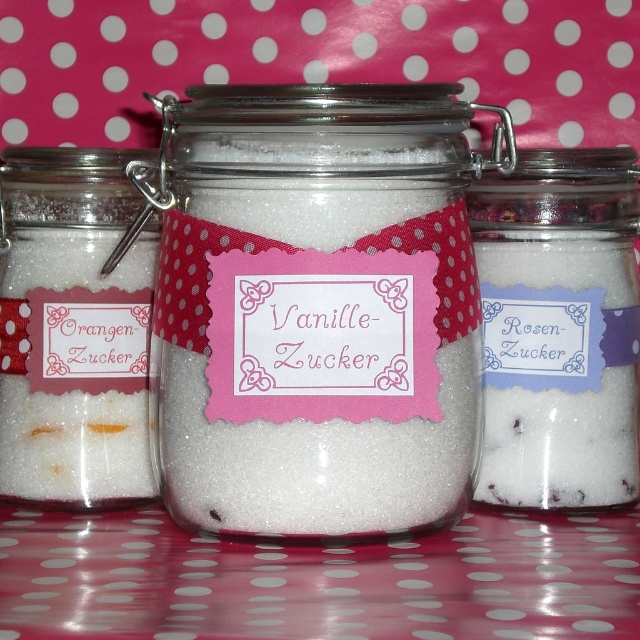
Question: Can you confirm if white sugar at center is positioned to the right of matte white sugar at left?

Choices:
 (A) no
 (B) yes

Answer: (B)

Question: Is pink polka dot fabric at center below white sugar at center?

Choices:
 (A) yes
 (B) no

Answer: (A)

Question: Which point is closer to the camera?

Choices:
 (A) white matte sugar at center
 (B) white sugar at center

Answer: (A)

Question: Is white matte sugar at center above matte white sugar at left?

Choices:
 (A) no
 (B) yes

Answer: (B)

Question: Considering the real-world distances, which object is farthest from the matte white sugar at left?

Choices:
 (A) white sugar at center
 (B) white matte sugar at center
 (C) pink polka dot fabric at center

Answer: (A)

Question: Which object is positioned closest to the pink polka dot fabric at center?

Choices:
 (A) white matte sugar at center
 (B) matte white sugar at left
 (C) white sugar at center

Answer: (A)